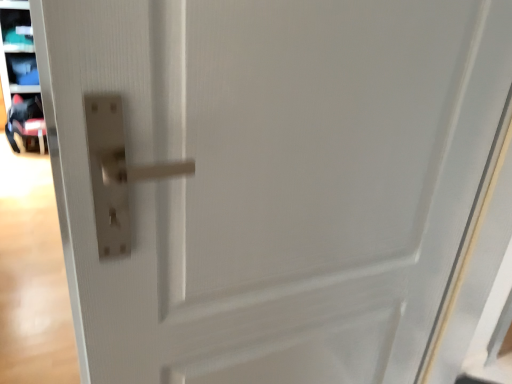
At what (x,y) coordinates should I click in order to perform the action: click on black fabric baby carriage at left. Please return your answer as a coordinate pair (x, y). Looking at the image, I should click on (22, 118).

This screenshot has height=384, width=512. Describe the element at coordinates (22, 118) in the screenshot. I see `black fabric baby carriage at left` at that location.

In order to face matte plastic shelf at upper left, should I rotate leftwards or rightwards?

Rotate left and turn 28.446 degrees.

The image size is (512, 384). Find the location of `matte plastic shelf at upper left`. matte plastic shelf at upper left is located at coordinates pos(22,69).

Measure the distance between matte plastic shelf at upper left and camera.

The distance of matte plastic shelf at upper left from camera is 3.61 meters.

What do you see at coordinates (22, 69) in the screenshot?
I see `matte plastic shelf at upper left` at bounding box center [22, 69].

The width and height of the screenshot is (512, 384). Find the location of `black fabric baby carriage at left`. black fabric baby carriage at left is located at coordinates (22, 118).

In the image, is black fabric baby carriage at left on the left side or the right side of matte plastic shelf at upper left?

black fabric baby carriage at left is to the right of matte plastic shelf at upper left.

Considering the positions of objects black fabric baby carriage at left and matte plastic shelf at upper left in the image provided, who is behind, black fabric baby carriage at left or matte plastic shelf at upper left?

matte plastic shelf at upper left is more distant.

Which is behind, point (12, 139) or point (9, 57)?

The point (9, 57) is behind.

From the image's perspective, is black fabric baby carriage at left under matte plastic shelf at upper left?

Correct, black fabric baby carriage at left appears lower than matte plastic shelf at upper left in the image.

From a real-world perspective, is black fabric baby carriage at left beneath matte plastic shelf at upper left?

Yes.

Which object is thinner, black fabric baby carriage at left or matte plastic shelf at upper left?

A: Thinner between the two is matte plastic shelf at upper left.

From their relative heights in the image, would you say black fabric baby carriage at left is taller or shorter than matte plastic shelf at upper left?

In the image, black fabric baby carriage at left appears to be shorter than matte plastic shelf at upper left.

Does black fabric baby carriage at left have a smaller size compared to matte plastic shelf at upper left?

No, black fabric baby carriage at left is not smaller than matte plastic shelf at upper left.

Is black fabric baby carriage at left inside the boundaries of matte plastic shelf at upper left, or outside?

The correct answer is: outside.

In the scene shown: Is black fabric baby carriage at left directly adjacent to matte plastic shelf at upper left?

No, black fabric baby carriage at left is not next to matte plastic shelf at upper left.

Could you tell me if black fabric baby carriage at left is turned towards matte plastic shelf at upper left?

No, black fabric baby carriage at left does not turn towards matte plastic shelf at upper left.

How many degrees apart are the facing directions of black fabric baby carriage at left and matte plastic shelf at upper left?

82.2 degrees.

Image resolution: width=512 pixels, height=384 pixels. What are the coordinates of `baby carriage below the matte plastic shelf at upper left (from the image's perspective)` in the screenshot? It's located at (22, 118).

Based on their positions, is matte plastic shelf at upper left located to the left or right of black fabric baby carriage at left?

Based on their positions, matte plastic shelf at upper left is located to the left of black fabric baby carriage at left.

Consider the image. Between matte plastic shelf at upper left and black fabric baby carriage at left, which one is positioned in front?

black fabric baby carriage at left is more forward.

Is point (13, 64) farther from viewer compared to point (29, 104)?

Yes.

From the image's perspective, which one is positioned higher, matte plastic shelf at upper left or black fabric baby carriage at left?

matte plastic shelf at upper left is shown above in the image.

From a real-world perspective, is matte plastic shelf at upper left under black fabric baby carriage at left?

No, from a real-world perspective, matte plastic shelf at upper left is not beneath black fabric baby carriage at left.

Which object is wider, matte plastic shelf at upper left or black fabric baby carriage at left?

black fabric baby carriage at left.

Can you confirm if matte plastic shelf at upper left is shorter than black fabric baby carriage at left?

Incorrect, the height of matte plastic shelf at upper left does not fall short of that of black fabric baby carriage at left.

Between matte plastic shelf at upper left and black fabric baby carriage at left, which one has larger size?

Bigger between the two is black fabric baby carriage at left.

Looking at this image, would you say matte plastic shelf at upper left is outside black fabric baby carriage at left?

That's correct, matte plastic shelf at upper left is outside of black fabric baby carriage at left.

Is matte plastic shelf at upper left beside black fabric baby carriage at left?

matte plastic shelf at upper left and black fabric baby carriage at left are not in contact.

Is black fabric baby carriage at left at the back of matte plastic shelf at upper left?

No.

What's the angular difference between matte plastic shelf at upper left and black fabric baby carriage at left's facing directions?

82.2 degrees.

Find the location of a particular element. baby carriage in front of the matte plastic shelf at upper left is located at coordinates (22, 118).

Identify the location of baby carriage below the matte plastic shelf at upper left (from a real-world perspective). (22, 118).

Identify the location of shelf that appears above the black fabric baby carriage at left (from the image's perspective). (22, 69).